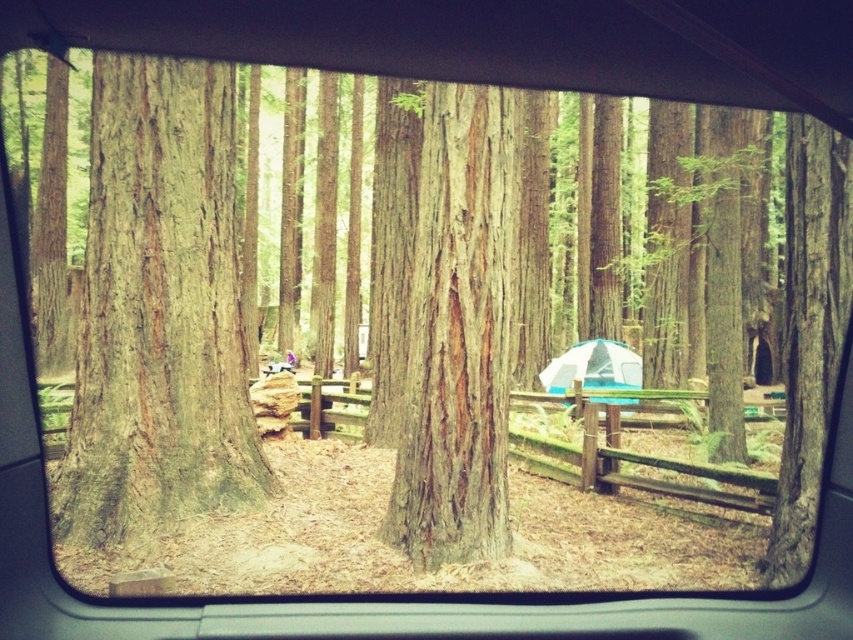
You are sitting in the back seat of the vehicle and notice two points in the forest scene through the rear window. The first point is at coordinates point (450, 189) and the second is at point (630, 388). Which point is closer to your position inside the vehicle?

Point (450, 189) is in front of point (630, 388), so it is closer to your position inside the vehicle.